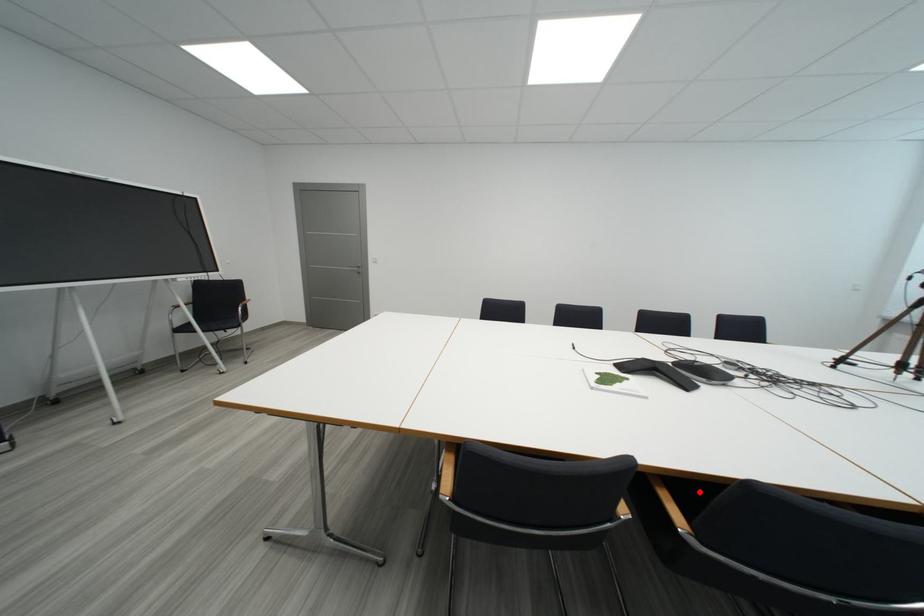
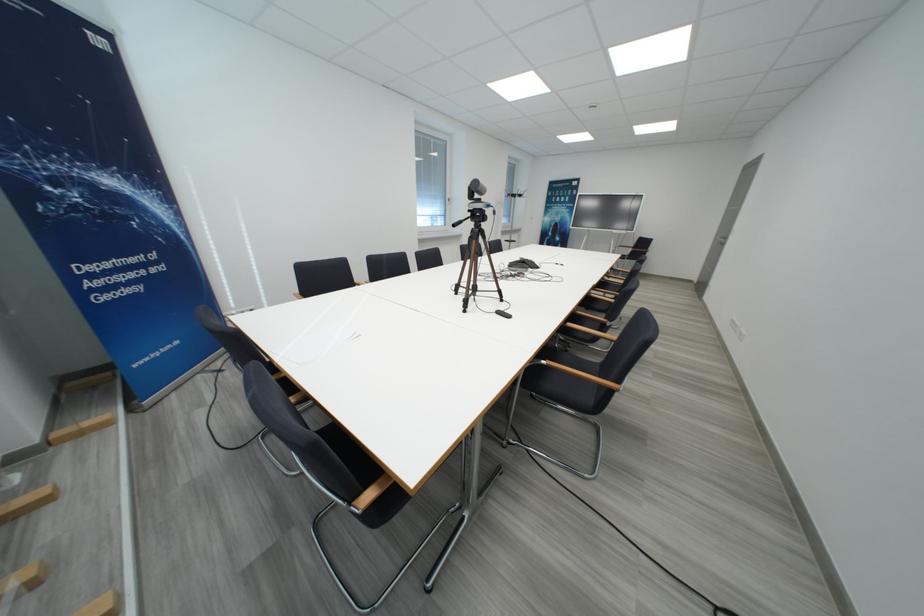
Question: I am providing you with two images of the same scene from different viewpoints. A red point is marked on the first image. Is the red point's position out of view in image 2?

Choices:
 (A) Yes
 (B) No

Answer: (A)